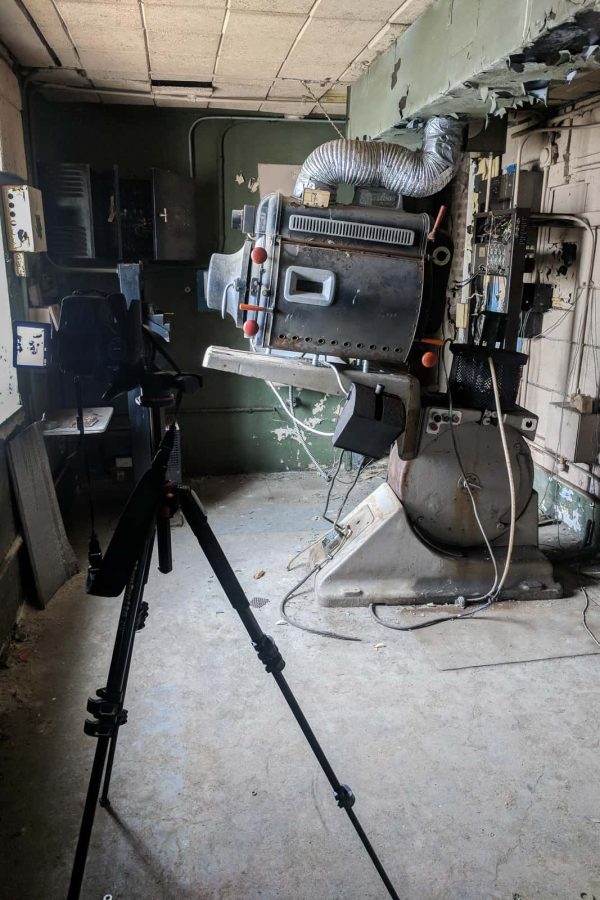
Locate an element on the screen. concrete ceiling is located at coordinates (257, 47).